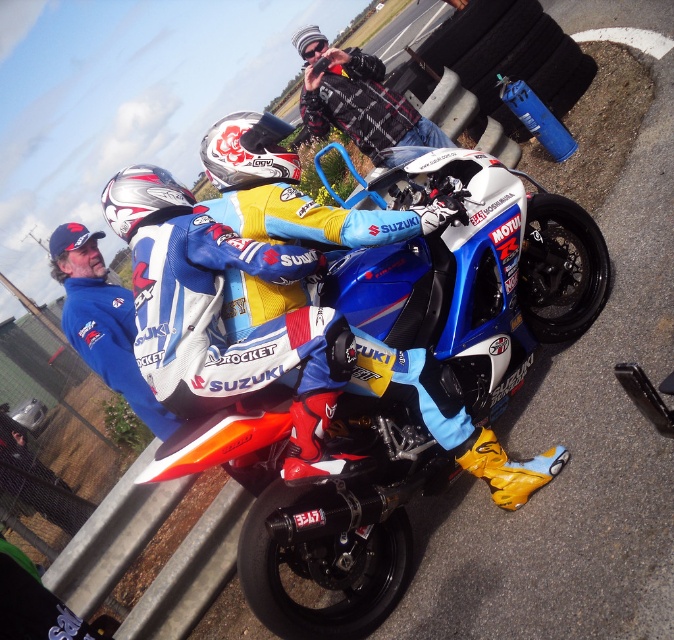
Question: Which point appears closest to the camera in this image?

Choices:
 (A) (239, 128)
 (B) (133, 380)
 (C) (129, 172)
 (D) (293, 273)

Answer: (D)

Question: Which point is farther to the camera?

Choices:
 (A) (239, 188)
 (B) (133, 193)

Answer: (A)

Question: Can you confirm if blue fabric jacket at left is positioned below silver metallic helmet at upper left?

Choices:
 (A) yes
 (B) no

Answer: (A)

Question: Is blue fabric jacket at left below silver metallic helmet at upper left?

Choices:
 (A) yes
 (B) no

Answer: (A)

Question: Is matte blue and white racing suit at center positioned at the back of white matte helmet at upper center?

Choices:
 (A) yes
 (B) no

Answer: (B)

Question: Which point is closer to the camera taking this photo?

Choices:
 (A) (63, 314)
 (B) (241, 148)

Answer: (B)